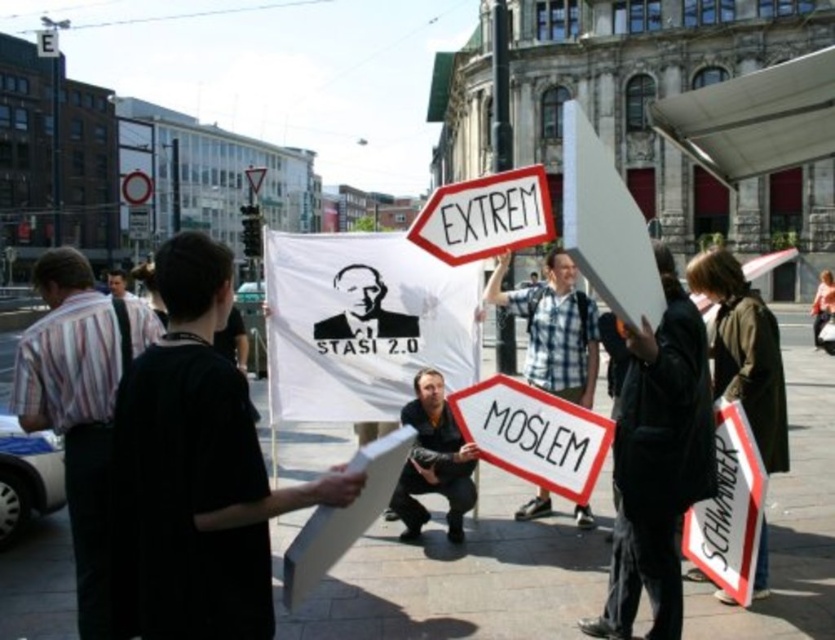
What are the coordinates of the plaid fabric shirt at center in the image?

The plaid fabric shirt at center is located at coordinates (553,326).